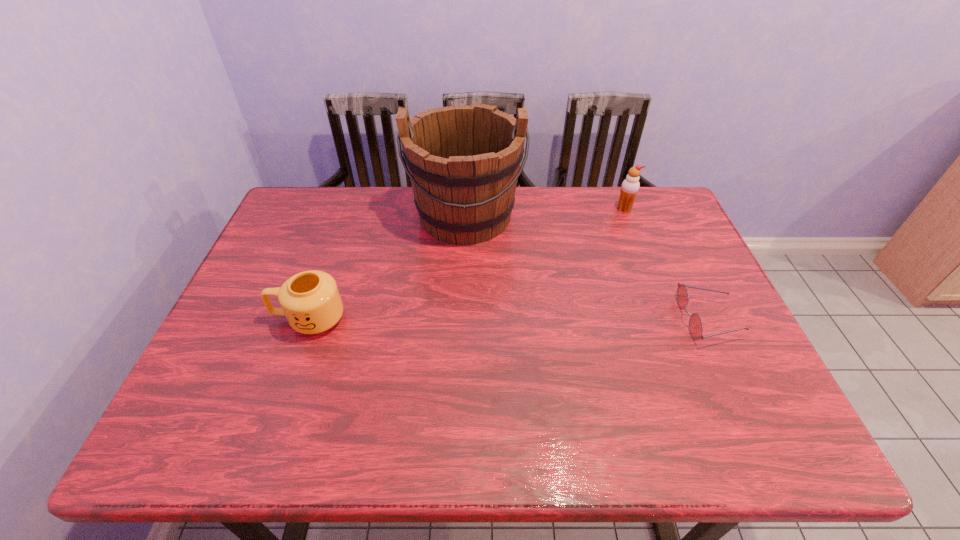
In order to click on blank space located 0.050m at the front with a straw on the icecream in this screenshot , I will do `click(614, 221)`.

Identify the location of free region located at the front with a straw on the icecream. Image resolution: width=960 pixels, height=540 pixels. (609, 227).

You are a GUI agent. You are given a task and a screenshot of the screen. Output one action in this format:
    pyautogui.click(x=<x>, y=<y>)
    Task: Click on the free space located 0.190m at the front with a straw on the icecream
    
    Given the screenshot: What is the action you would take?
    pyautogui.click(x=595, y=245)

I want to click on free location located 0.200m on the side of the tallest object with the handle for carrying, so click(462, 302).

Identify the location of vacant point located 0.280m on the side of the tallest object with the handle for carrying. (461, 327).

This screenshot has height=540, width=960. Identify the location of vacant area located 0.350m on the side of the tallest object with the handle for carrying. (460, 350).

Identify the location of icecream present at the far edge. This screenshot has height=540, width=960. (630, 186).

You are a GUI agent. You are given a task and a screenshot of the screen. Output one action in this format:
    pyautogui.click(x=<x>, y=<y>)
    Task: Click on the wine bucket situated at the far edge
    
    Given the screenshot: What is the action you would take?
    pyautogui.click(x=463, y=161)

Identify the location of object that is at the left edge. (310, 300).

Find the location of a particular element. spectacles located in the right edge section of the desktop is located at coordinates (695, 323).